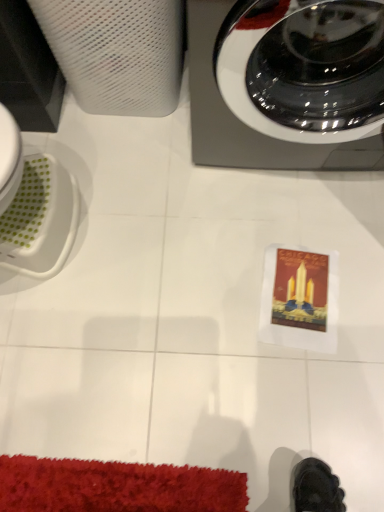
The image size is (384, 512). Describe the element at coordinates (118, 52) in the screenshot. I see `white mesh paper towel at upper left` at that location.

You are a GUI agent. You are given a task and a screenshot of the screen. Output one action in this format:
    pyautogui.click(x=<x>, y=<y>)
    Task: Click on the white mesh paper towel at upper left
    
    Given the screenshot: What is the action you would take?
    pyautogui.click(x=118, y=52)

What do you see at coordinates (245, 124) in the screenshot?
I see `metallic gray washing machine at upper right` at bounding box center [245, 124].

You are a GUI agent. You are given a task and a screenshot of the screen. Output one action in this format:
    pyautogui.click(x=<x>, y=<y>)
    Task: Click on the metallic gray washing machine at upper right
    This screenshot has height=512, width=384.
    Given the screenshot: What is the action you would take?
    pyautogui.click(x=245, y=124)

Find the location of a particular element. white mesh paper towel at upper left is located at coordinates (118, 52).

Which object is positioned more to the left, white mesh paper towel at upper left or metallic gray washing machine at upper right?

white mesh paper towel at upper left is more to the left.

Which object is closer to the camera taking this photo, white mesh paper towel at upper left or metallic gray washing machine at upper right?

metallic gray washing machine at upper right is more forward.

Is point (167, 86) positioned behind point (272, 147)?

Yes, it is behind point (272, 147).

From the image's perspective, which is above, white mesh paper towel at upper left or metallic gray washing machine at upper right?

white mesh paper towel at upper left.

From a real-world perspective, is white mesh paper towel at upper left physically below metallic gray washing machine at upper right?

Correct, in the physical world, white mesh paper towel at upper left is lower than metallic gray washing machine at upper right.

Which object is thinner, white mesh paper towel at upper left or metallic gray washing machine at upper right?

Thinner between the two is white mesh paper towel at upper left.

Who is taller, white mesh paper towel at upper left or metallic gray washing machine at upper right?

With more height is metallic gray washing machine at upper right.

Considering the sizes of objects white mesh paper towel at upper left and metallic gray washing machine at upper right in the image provided, who is smaller, white mesh paper towel at upper left or metallic gray washing machine at upper right?

white mesh paper towel at upper left is smaller.

Can we say white mesh paper towel at upper left lies outside metallic gray washing machine at upper right?

white mesh paper towel at upper left is positioned outside metallic gray washing machine at upper right.

Does white mesh paper towel at upper left touch metallic gray washing machine at upper right?

white mesh paper towel at upper left and metallic gray washing machine at upper right are clearly separated.

Is white mesh paper towel at upper left looking in the opposite direction of metallic gray washing machine at upper right?

No.

How different are the orientations of white mesh paper towel at upper left and metallic gray washing machine at upper right in degrees?

The angle between the facing direction of white mesh paper towel at upper left and the facing direction of metallic gray washing machine at upper right is 5.79 degrees.

Measure the distance between white mesh paper towel at upper left and metallic gray washing machine at upper right.

white mesh paper towel at upper left is 11.53 inches away from metallic gray washing machine at upper right.

Identify the location of paper towel to the left of metallic gray washing machine at upper right. (118, 52).

Is metallic gray washing machine at upper right to the left or to the right of white mesh paper towel at upper left in the image?

Based on their positions, metallic gray washing machine at upper right is located to the right of white mesh paper towel at upper left.

Which is behind, metallic gray washing machine at upper right or white mesh paper towel at upper left?

white mesh paper towel at upper left.

Is point (201, 81) closer to viewer compared to point (125, 9)?

That is True.

From the image's perspective, between metallic gray washing machine at upper right and white mesh paper towel at upper left, which one is located above?

From the image's view, white mesh paper towel at upper left is above.

From a real-world perspective, does metallic gray washing machine at upper right sit lower than white mesh paper towel at upper left?

No.

Which object is wider, metallic gray washing machine at upper right or white mesh paper towel at upper left?

With larger width is metallic gray washing machine at upper right.

Who is shorter, metallic gray washing machine at upper right or white mesh paper towel at upper left?

white mesh paper towel at upper left.

Between metallic gray washing machine at upper right and white mesh paper towel at upper left, which one has larger size?

metallic gray washing machine at upper right is bigger.

Is metallic gray washing machine at upper right not within white mesh paper towel at upper left?

Yes, metallic gray washing machine at upper right is located beyond the bounds of white mesh paper towel at upper left.

Is the surface of metallic gray washing machine at upper right in direct contact with white mesh paper towel at upper left?

metallic gray washing machine at upper right and white mesh paper towel at upper left are not in contact.

Is metallic gray washing machine at upper right looking in the opposite direction of white mesh paper towel at upper left?

metallic gray washing machine at upper right is not turned away from white mesh paper towel at upper left.

What's the angular difference between metallic gray washing machine at upper right and white mesh paper towel at upper left's facing directions?

The facing directions of metallic gray washing machine at upper right and white mesh paper towel at upper left are 5.79 degrees apart.

How far apart are metallic gray washing machine at upper right and white mesh paper towel at upper left?

metallic gray washing machine at upper right and white mesh paper towel at upper left are 11.53 inches apart from each other.

The image size is (384, 512). Find the location of `paper towel below the metallic gray washing machine at upper right (from a real-world perspective)`. paper towel below the metallic gray washing machine at upper right (from a real-world perspective) is located at coordinates (118, 52).

I want to click on home appliance lying in front of the white mesh paper towel at upper left, so click(x=245, y=124).

At what (x,y) coordinates should I click in order to perform the action: click on paper towel below the metallic gray washing machine at upper right (from a real-world perspective). Please return your answer as a coordinate pair (x, y). Looking at the image, I should click on (118, 52).